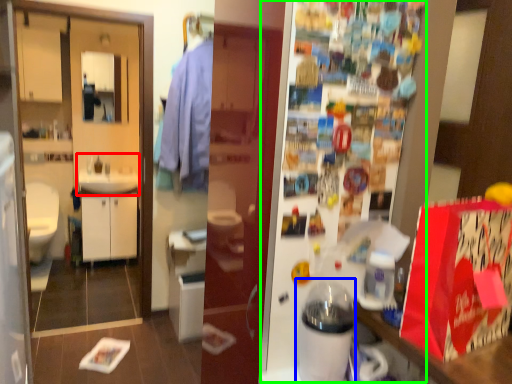
Question: Which object is the closest to the sink (highlighted by a red box)? Choose among these: appliance (highlighted by a blue box) or fridge (highlighted by a green box).

Choices:
 (A) appliance
 (B) fridge

Answer: (B)